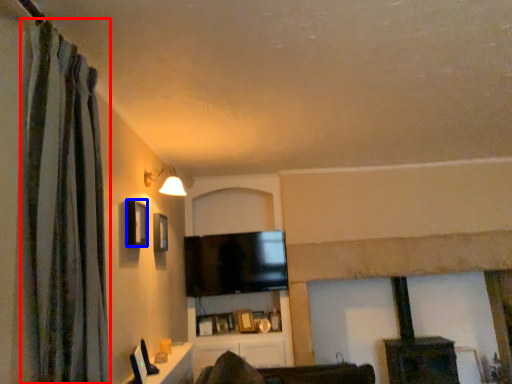
Question: Which object appears farthest to the camera in this image, curtain (highlighted by a red box) or window (highlighted by a blue box)?

Choices:
 (A) curtain
 (B) window

Answer: (B)